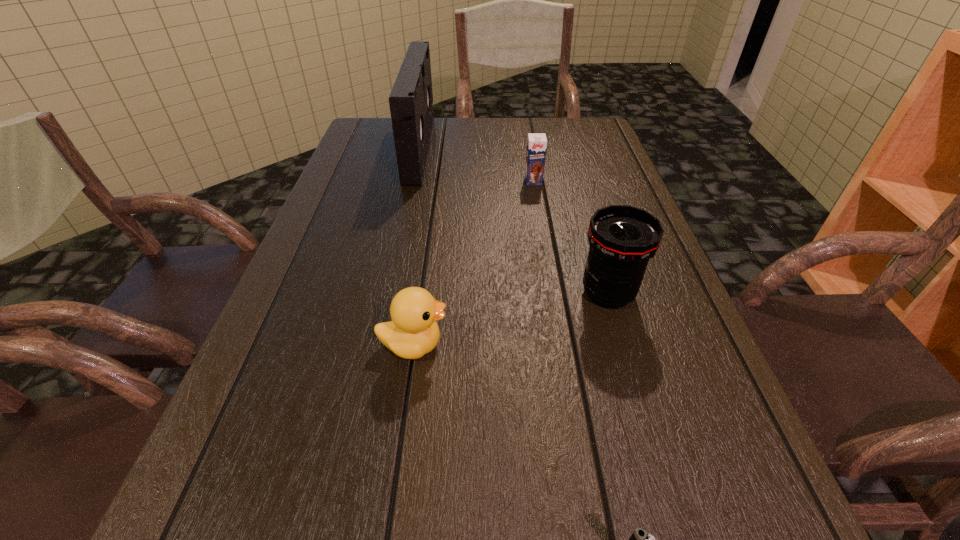
The height and width of the screenshot is (540, 960). In order to click on free space between the videotape and the duck in this screenshot , I will do `click(417, 247)`.

In order to click on free space between the second tallest object and the tallest object in this screenshot , I will do `click(514, 221)`.

Find the location of `vacant region between the tallest object and the duck`. vacant region between the tallest object and the duck is located at coordinates (417, 247).

This screenshot has width=960, height=540. What are the coordinates of `object that can be found as the closest to the duck` in the screenshot? It's located at (622, 238).

At what (x,y) coordinates should I click in order to perform the action: click on object that is the second closest to the third nearest object. Please return your answer as a coordinate pair (x, y). The width and height of the screenshot is (960, 540). Looking at the image, I should click on (536, 144).

You are a GUI agent. You are given a task and a screenshot of the screen. Output one action in this format:
    pyautogui.click(x=<x>, y=<y>)
    Task: Click on the vacant space that satisfies the following two spatial constraints: 1. on the front label of the chocolate milk; 2. on the face of the duck
    This screenshot has height=540, width=960.
    Given the screenshot: What is the action you would take?
    pyautogui.click(x=562, y=345)

Find the location of a particular element. Image resolution: width=960 pixels, height=540 pixels. vacant space that satisfies the following two spatial constraints: 1. on the front label of the third object from left to right; 2. on the right side of the telephoto lens is located at coordinates (553, 294).

I want to click on free space that satisfies the following two spatial constraints: 1. on the side of the telephoto lens with visible spindles; 2. on the right side of the videotape, so click(389, 294).

At what (x,y) coordinates should I click in order to perform the action: click on vacant space that satisfies the following two spatial constraints: 1. on the back side of the third farthest object; 2. on the side of the videotape with visible spindles. Please return your answer as a coordinate pair (x, y). The height and width of the screenshot is (540, 960). Looking at the image, I should click on (564, 148).